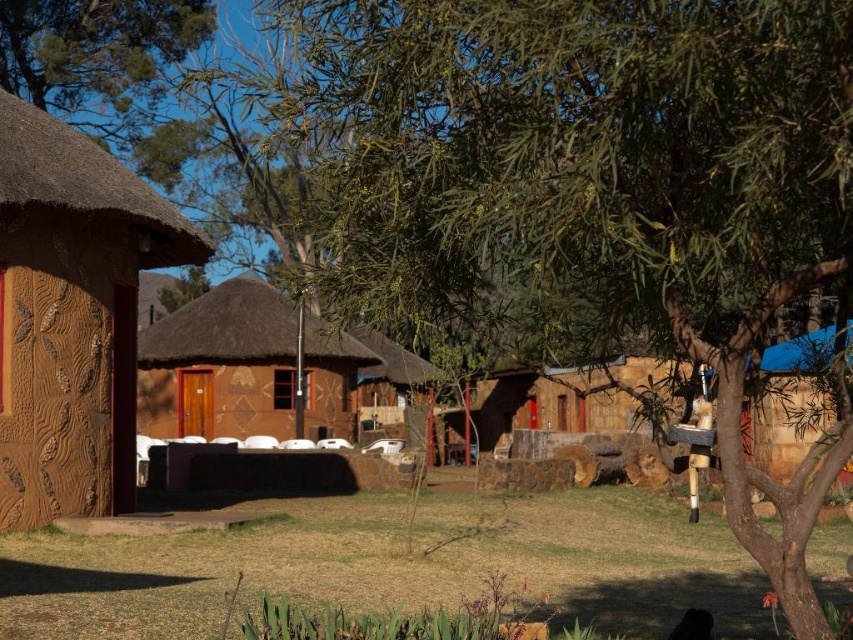
Question: Is brown thatched hut at center bigger than brown textured hut at center?

Choices:
 (A) yes
 (B) no

Answer: (A)

Question: Does brown thatched hut at center have a smaller size compared to brown textured hut at center?

Choices:
 (A) no
 (B) yes

Answer: (A)

Question: Which point is farther to the camera?

Choices:
 (A) (22, 557)
 (B) (529, 381)

Answer: (B)

Question: Among these points, which one is nearest to the camera?

Choices:
 (A) (718, 593)
 (B) (628, 388)
 (C) (293, 339)
 (D) (22, 220)

Answer: (B)

Question: Can you confirm if green grass at lower center is positioned to the left of brown textured hut at center?

Choices:
 (A) no
 (B) yes

Answer: (B)

Question: Which point is closer to the camera taking this photo?

Choices:
 (A) (312, 337)
 (B) (212, 550)
 (C) (86, 177)

Answer: (B)